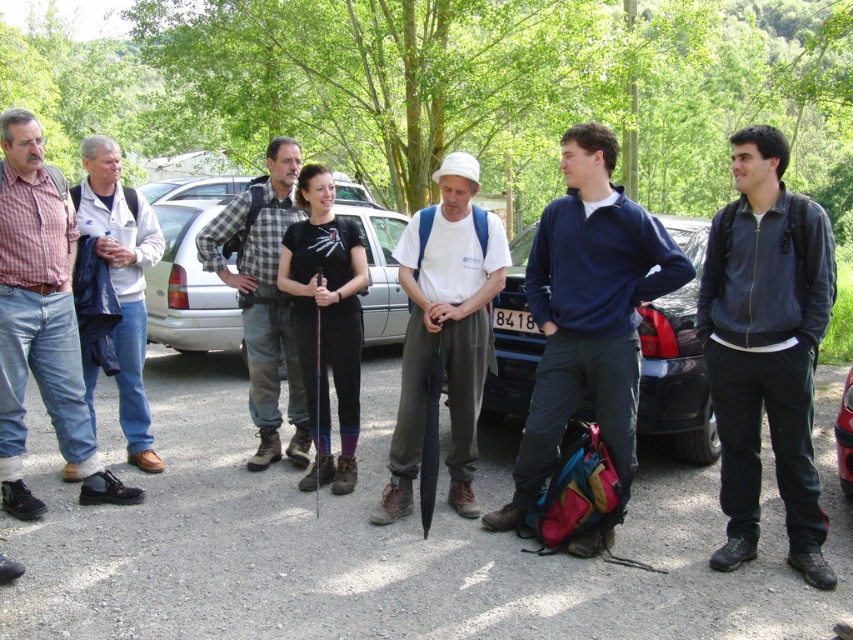
Question: Which object is closer to the camera taking this photo?

Choices:
 (A) white cotton jacket at left
 (B) plaid fabric shirt at center

Answer: (A)

Question: Is white matte t-shirt at center above black matte t-shirt at center?

Choices:
 (A) yes
 (B) no

Answer: (B)

Question: Which of these objects is positioned closest to the dark blue jacket at right?

Choices:
 (A) white cotton jacket at left
 (B) blue metallic car at center
 (C) metallic red car at center

Answer: (B)

Question: Which point is farther to the camera?

Choices:
 (A) white cotton jacket at left
 (B) plaid fabric shirt at center
 (C) dark blue jacket at right

Answer: (B)

Question: Is brushed metal jacket at left to the left of blue metallic car at center from the viewer's perspective?

Choices:
 (A) no
 (B) yes

Answer: (B)

Question: Where is blue metallic car at center located in relation to black matte t-shirt at center in the image?

Choices:
 (A) left
 (B) right

Answer: (B)